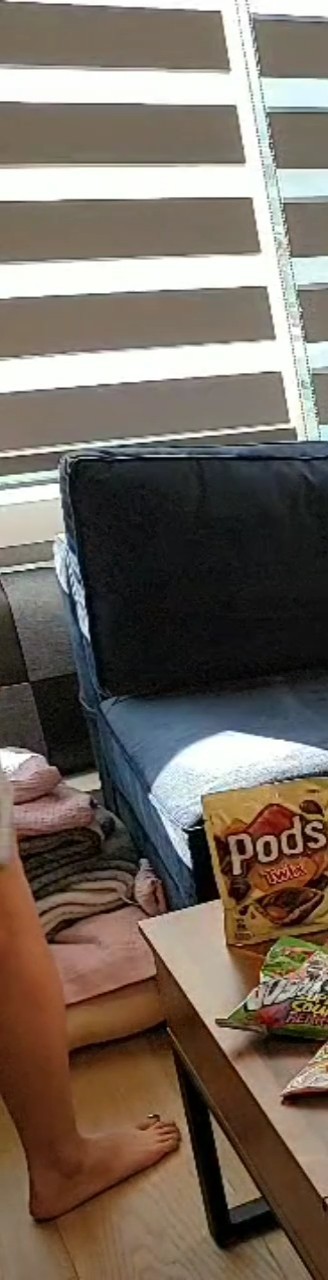
At what (x,y) coordinates should I click in order to perform the action: click on blind. Please return your answer as a coordinate pair (x, y). The width and height of the screenshot is (328, 1280). Looking at the image, I should click on (197, 320).